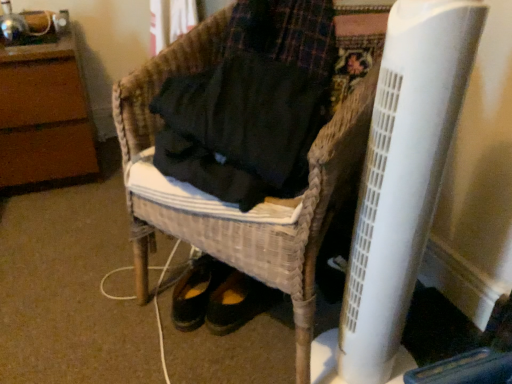
Locate an element on the screen. The height and width of the screenshot is (384, 512). free space in front of brown wood dresser at upper left, the first furniture in the left-to-right sequence is located at coordinates (54, 215).